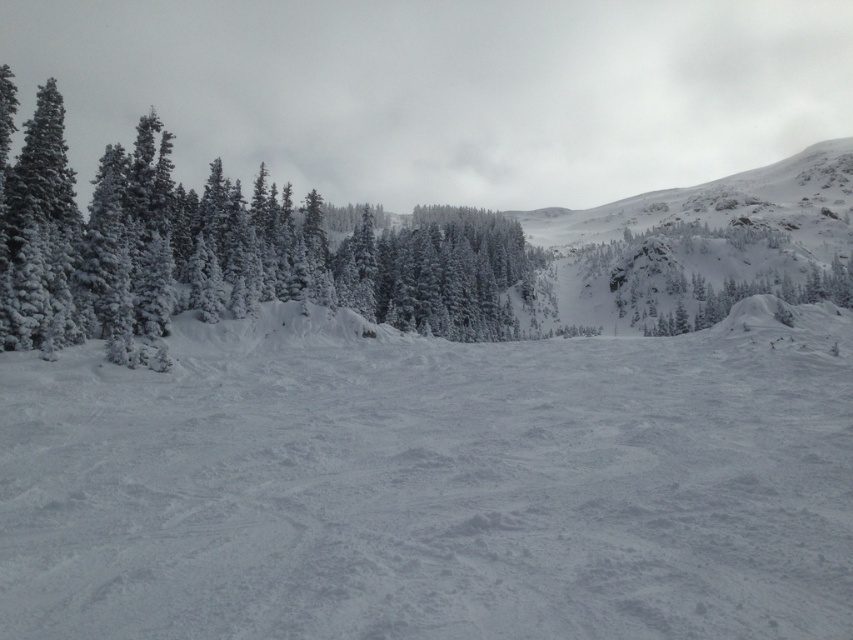
You are standing in the winter landscape and want to walk from the white frosty trees at left to the white snow at center. Which direction should you move?

You should move to the right because the white snow at center is positioned on the right side of the white frosty trees at left.

You are standing at the point marked by coordinates point (433, 484), which is the white snow at center. Looking around, you see the dense cluster of evergreen trees in the middle ground and the gently sloping hillside in the background. Which direction should you move to reach the dense cluster of evergreen trees first?

Since you are standing at the white snow at center marked by point (433, 484), the dense cluster of evergreen trees in the middle ground is closer than the gently sloping hillside in the background. Therefore, moving towards the middle ground direction will reach the dense cluster of evergreen trees first.

You are standing in the snowy landscape and want to walk towards the distant hillside. Which object, the white snow at center or the white frosty trees at left, will you encounter first?

The white snow at center is in front of the white frosty trees at left, so you will encounter the white snow at center first.